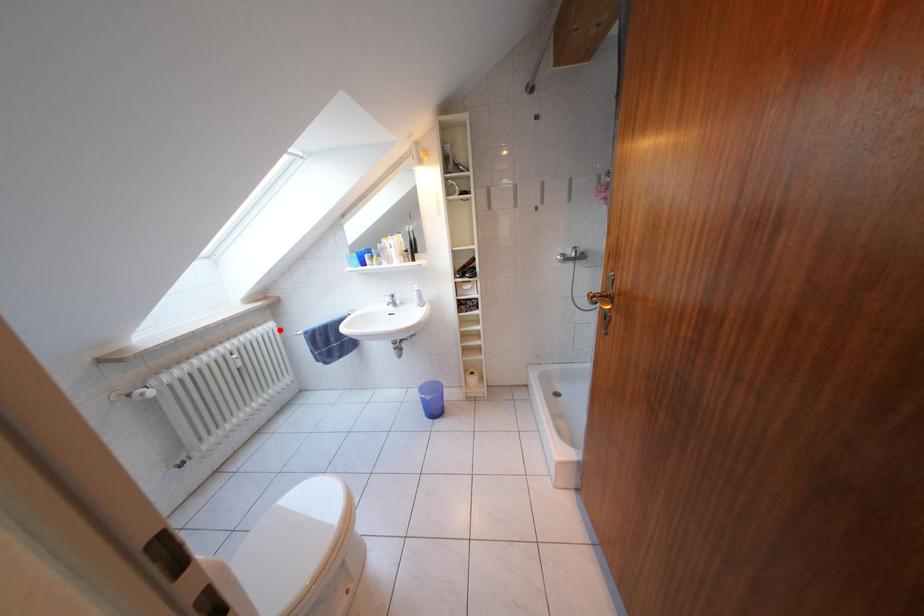
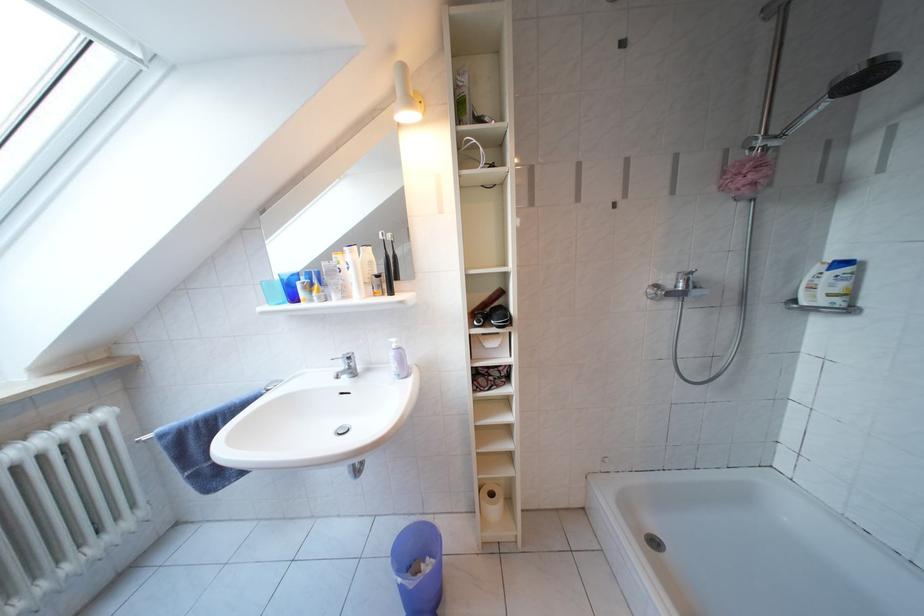
In the second image, find the point that corresponds to the highlighted location in the first image.

(110, 421)